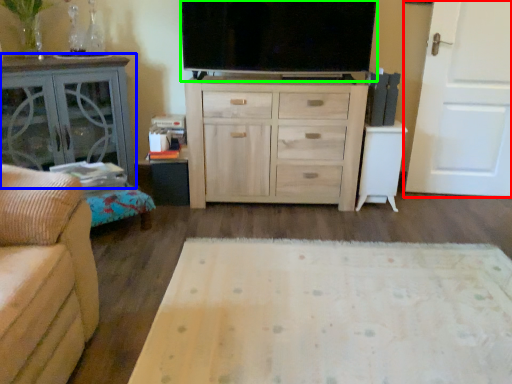
Question: Estimate the real-world distances between objects in this image. Which object is closer to door (highlighted by a red box), table (highlighted by a blue box) or television (highlighted by a green box)?

Choices:
 (A) table
 (B) television

Answer: (B)